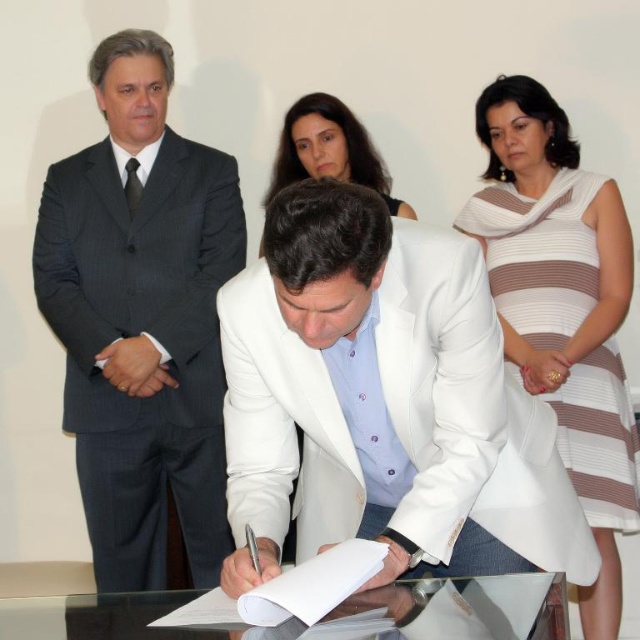
You are an event planner assessing the layout of the signing ceremony. The dark gray pinstripe suit at left and the transparent glass table at center are both in the scene. Which object takes up more horizontal space in the image?

The transparent glass table at center takes up more horizontal space than the dark gray pinstripe suit at left because the dark gray pinstripe suit at left is thinner than the transparent glass table at center.

You are a photographer at the event and need to capture a clear shot of the dark gray pinstripe suit at left and the transparent glass table at center. Based on their positions, which object is higher in the image?

The dark gray pinstripe suit at left is above the transparent glass table at center, so the dark gray pinstripe suit at left is higher in the image.